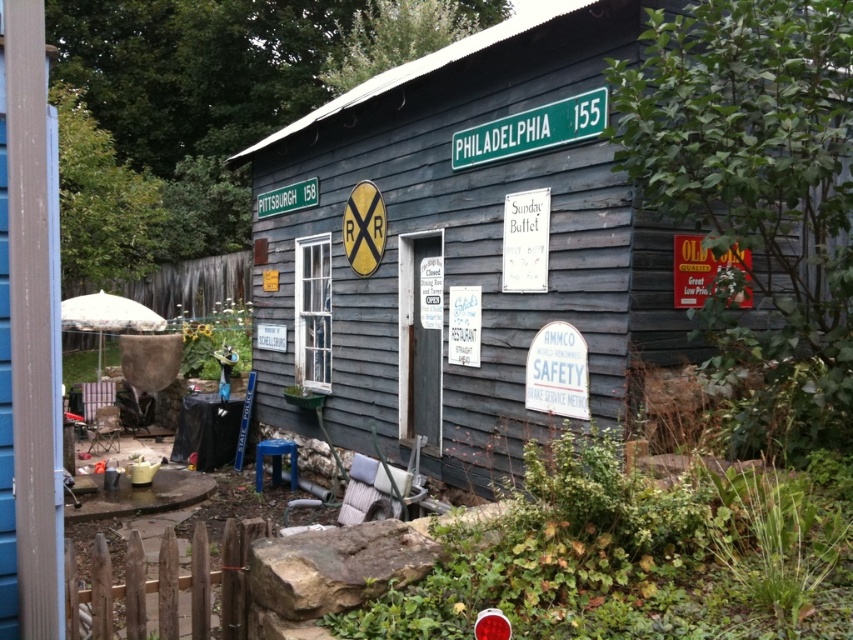
Question: Does weathered wood hut at center appear on the left side of green plastic street sign at upper center?

Choices:
 (A) yes
 (B) no

Answer: (B)

Question: Is weathered wood hut at center smaller than green plastic street sign at upper center?

Choices:
 (A) yes
 (B) no

Answer: (A)

Question: Which object is farther from the camera taking this photo?

Choices:
 (A) green plastic street sign at upper center
 (B) weathered wood hut at center

Answer: (A)

Question: Can you confirm if weathered wood hut at center is wider than green plastic street sign at upper center?

Choices:
 (A) yes
 (B) no

Answer: (B)